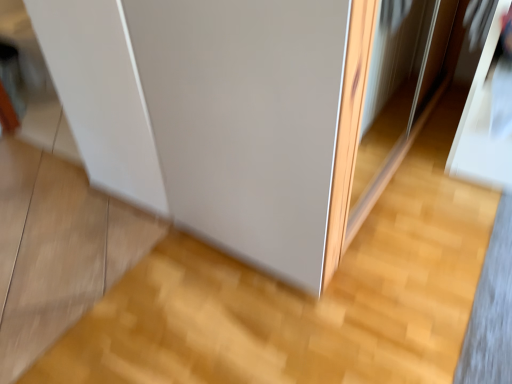
What is the approximate width of transparent glass screen door at center?

It is 34.31 inches.

Measure the distance between transparent glass screen door at center and camera.

The depth of transparent glass screen door at center is 32.30 inches.

Where is `transparent glass screen door at center`? This screenshot has height=384, width=512. transparent glass screen door at center is located at coordinates (246, 121).

This screenshot has width=512, height=384. Describe the element at coordinates (246, 121) in the screenshot. I see `transparent glass screen door at center` at that location.

Where is `transparent glass screen door at center`? The image size is (512, 384). transparent glass screen door at center is located at coordinates (246, 121).